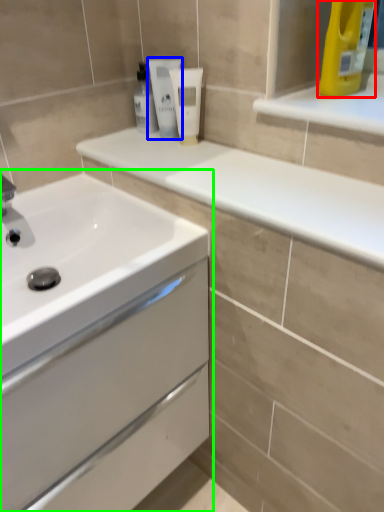
Question: Considering the real-world distances, which object is closest to cleaning product (highlighted by a red box)? mouthwash (highlighted by a blue box) or bathroom cabinet (highlighted by a green box).

Choices:
 (A) mouthwash
 (B) bathroom cabinet

Answer: (A)